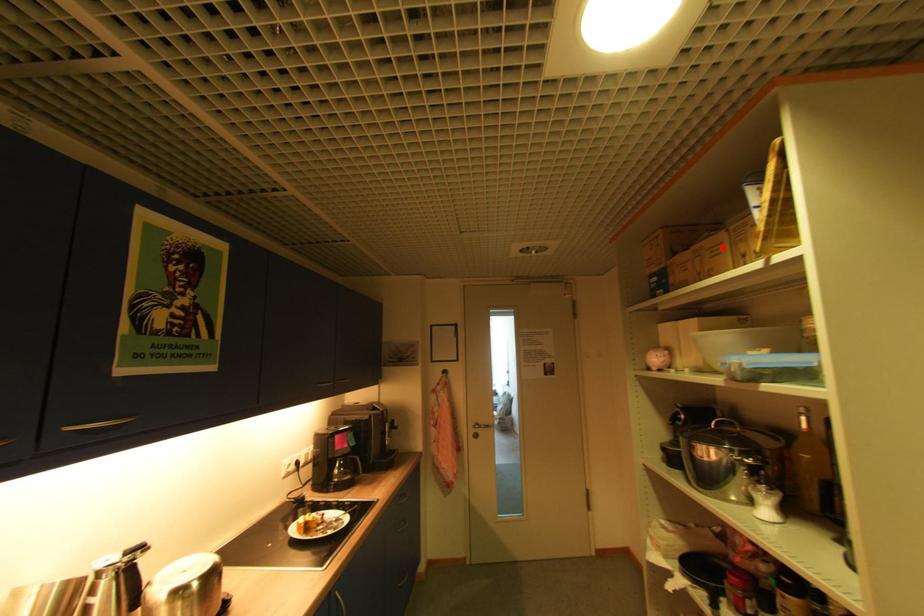
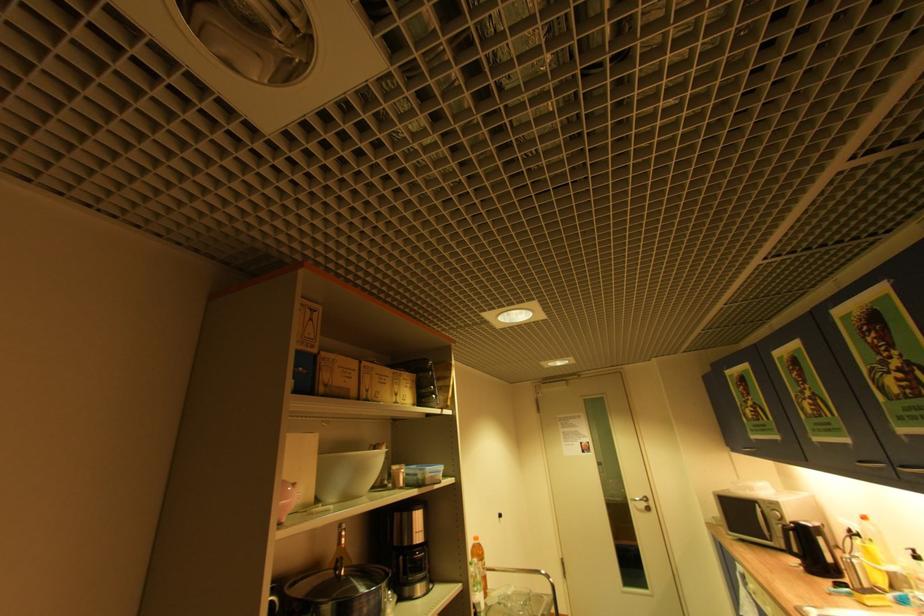
In the second image, find the point that corresponds to the highlighted location in the first image.

(391, 378)